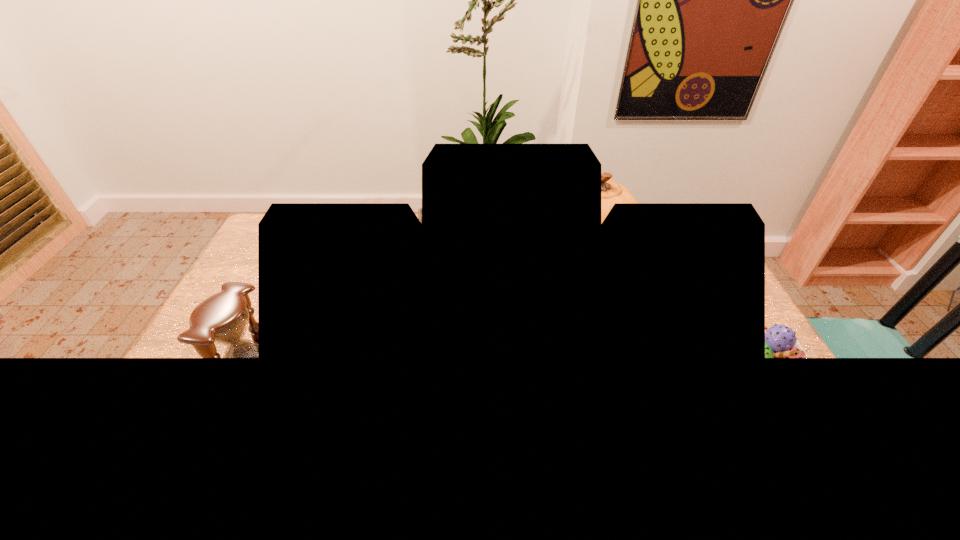
Image resolution: width=960 pixels, height=540 pixels. I want to click on free space on the desktop that is between the leftmost object and the shortest object and is positioned on the front face of the pumpkin, so click(x=548, y=374).

Where is `vacant space on the desktop that is between the leftmost object and the shortest object and is positioned on the horn of the second object from left to right`? The width and height of the screenshot is (960, 540). vacant space on the desktop that is between the leftmost object and the shortest object and is positioned on the horn of the second object from left to right is located at coordinates (448, 373).